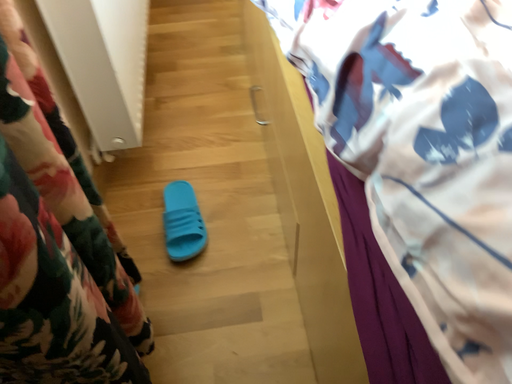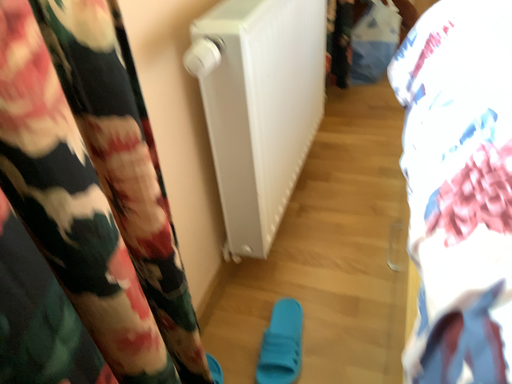
Question: Which way did the camera rotate in the video?

Choices:
 (A) rotated upward
 (B) rotated downward

Answer: (A)